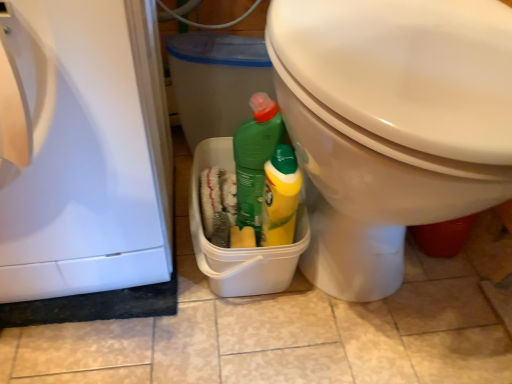
Find the location of `white glossy dishwasher at left`. white glossy dishwasher at left is located at coordinates (88, 152).

The height and width of the screenshot is (384, 512). What do you see at coordinates (88, 152) in the screenshot? I see `white glossy dishwasher at left` at bounding box center [88, 152].

The width and height of the screenshot is (512, 384). I want to click on white glossy toilet at right, so click(x=391, y=124).

What is the approximate width of white glossy toilet at right?

white glossy toilet at right is 26.02 inches wide.

The image size is (512, 384). What do you see at coordinates (391, 124) in the screenshot?
I see `white glossy toilet at right` at bounding box center [391, 124].

Where is `white glossy dishwasher at left`? The width and height of the screenshot is (512, 384). white glossy dishwasher at left is located at coordinates (88, 152).

In the scene shown: Which is more to the right, white glossy dishwasher at left or white glossy toilet at right?

From the viewer's perspective, white glossy toilet at right appears more on the right side.

Is the depth of white glossy dishwasher at left less than that of white glossy toilet at right?

Yes, white glossy dishwasher at left is closer to the camera.

Does point (32, 182) lie in front of point (350, 195)?

No, (32, 182) is behind (350, 195).

From the image's perspective, is white glossy dishwasher at left located above or below white glossy toilet at right?

From the image's perspective, white glossy dishwasher at left appears below white glossy toilet at right.

From a real-world perspective, relative to white glossy toilet at right, is white glossy dishwasher at left vertically above or below?

In terms of real-world spatial position, white glossy dishwasher at left is above white glossy toilet at right.

Considering the sizes of white glossy dishwasher at left and white glossy toilet at right in the image, is white glossy dishwasher at left wider or thinner than white glossy toilet at right?

Considering their sizes, white glossy dishwasher at left looks slimmer than white glossy toilet at right.

Is white glossy dishwasher at left shorter than white glossy toilet at right?

Correct, white glossy dishwasher at left is not as tall as white glossy toilet at right.

Can you confirm if white glossy dishwasher at left is bigger than white glossy toilet at right?

No, white glossy dishwasher at left is not bigger than white glossy toilet at right.

Choose the correct answer: Is white glossy dishwasher at left inside white glossy toilet at right or outside it?

white glossy dishwasher at left is spatially situated outside white glossy toilet at right.

In the scene shown: Is white glossy dishwasher at left placed right next to white glossy toilet at right?

There is a gap between white glossy dishwasher at left and white glossy toilet at right.

Is white glossy dishwasher at left positioned with its back to white glossy toilet at right?

No, white glossy toilet at right is not at the back of white glossy dishwasher at left.

In the image, there is a white glossy toilet at right. Where is `dish washer below it (from the image's perspective)`? The image size is (512, 384). dish washer below it (from the image's perspective) is located at coordinates (88, 152).

In the scene shown: Would you say white glossy toilet at right is to the left or to the right of white glossy dishwasher at left in the picture?

Based on their positions, white glossy toilet at right is located to the right of white glossy dishwasher at left.

Does white glossy toilet at right lie in front of white glossy dishwasher at left?

No, white glossy toilet at right is further to the viewer.

Is point (307, 170) farther from camera compared to point (74, 128)?

Yes, it is behind point (74, 128).

From the image's perspective, which is below, white glossy toilet at right or white glossy dishwasher at left?

From the image's view, white glossy dishwasher at left is below.

From a real-world perspective, which object stands above the other?

white glossy dishwasher at left, from a real-world perspective.

Is white glossy toilet at right wider than white glossy dishwasher at left?

Yes.

Does white glossy toilet at right have a greater height compared to white glossy dishwasher at left?

Correct, white glossy toilet at right is much taller as white glossy dishwasher at left.

Considering the sizes of objects white glossy toilet at right and white glossy dishwasher at left in the image provided, who is bigger, white glossy toilet at right or white glossy dishwasher at left?

white glossy toilet at right is bigger.

Does white glossy toilet at right contain white glossy dishwasher at left?

No.

Can you see white glossy toilet at right touching white glossy dishwasher at left?

No, white glossy toilet at right is not in contact with white glossy dishwasher at left.

Is white glossy toilet at right aimed at white glossy dishwasher at left?

No, white glossy toilet at right is not facing towards white glossy dishwasher at left.

Measure the distance from white glossy toilet at right to white glossy dishwasher at left.

A distance of 11.35 inches exists between white glossy toilet at right and white glossy dishwasher at left.

You are a GUI agent. You are given a task and a screenshot of the screen. Output one action in this format:
    pyautogui.click(x=<x>, y=<y>)
    Task: Click on the dish washer that is above the white glossy toilet at right (from a real-world perspective)
    
    Given the screenshot: What is the action you would take?
    pyautogui.click(x=88, y=152)

The width and height of the screenshot is (512, 384). In order to click on dish washer located above the white glossy toilet at right (from a real-world perspective) in this screenshot , I will do `click(88, 152)`.

Image resolution: width=512 pixels, height=384 pixels. Identify the location of toilet that appears behind the white glossy dishwasher at left. (391, 124).